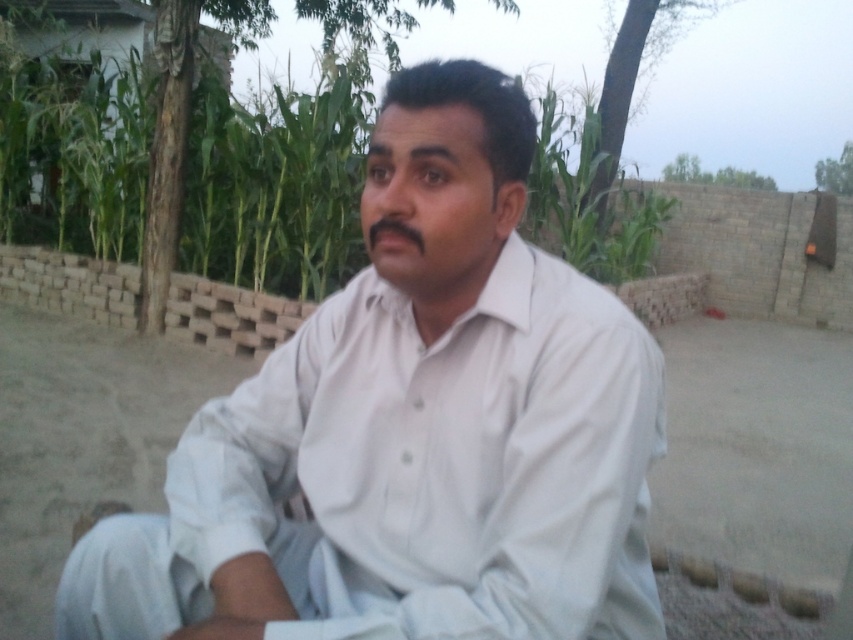
Question: Can you confirm if white cotton shirt at center is smaller than green leafy corn at center?

Choices:
 (A) no
 (B) yes

Answer: (A)

Question: Does white cotton shirt at center have a larger size compared to green leafy corn at center?

Choices:
 (A) no
 (B) yes

Answer: (B)

Question: From the image, what is the correct spatial relationship of white cotton shirt at center in relation to green leafy corn at center?

Choices:
 (A) left
 (B) right

Answer: (B)

Question: Which point is closer to the camera?

Choices:
 (A) (525, 609)
 (B) (97, 227)

Answer: (A)